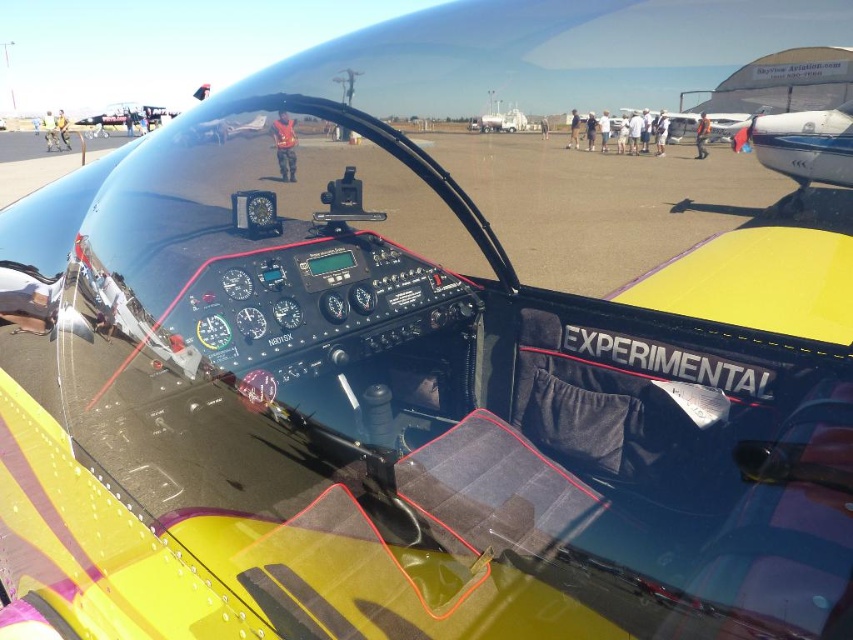
Question: Which point is farther to the camera?

Choices:
 (A) metallic blue propeller at right
 (B) red fabric jacket at center
 (C) yellow matte airplane at center

Answer: (C)

Question: Can you confirm if yellow matte airplane at center is smaller than red fabric jacket at center?

Choices:
 (A) yes
 (B) no

Answer: (B)

Question: Which object appears closest to the camera in this image?

Choices:
 (A) yellow matte airplane at center
 (B) metallic blue propeller at right

Answer: (B)

Question: Estimate the real-world distances between objects in this image. Which object is closer to the yellow matte airplane at center?

Choices:
 (A) metallic blue propeller at right
 (B) red fabric jacket at center

Answer: (A)

Question: Is metallic blue propeller at right below red fabric jacket at center?

Choices:
 (A) yes
 (B) no

Answer: (B)

Question: Can you confirm if metallic blue propeller at right is smaller than red fabric jacket at center?

Choices:
 (A) no
 (B) yes

Answer: (A)